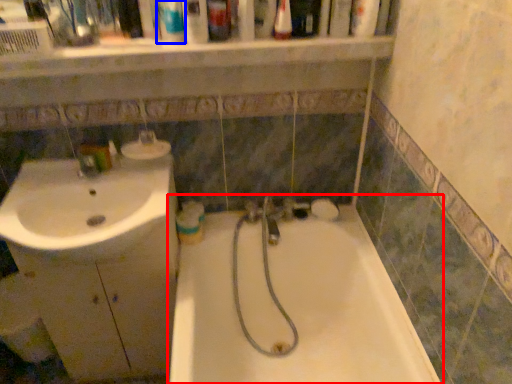
Question: Which of the following is the closest to the observer, bathtub (highlighted by a red box) or mouthwash (highlighted by a blue box)?

Choices:
 (A) bathtub
 (B) mouthwash

Answer: (A)